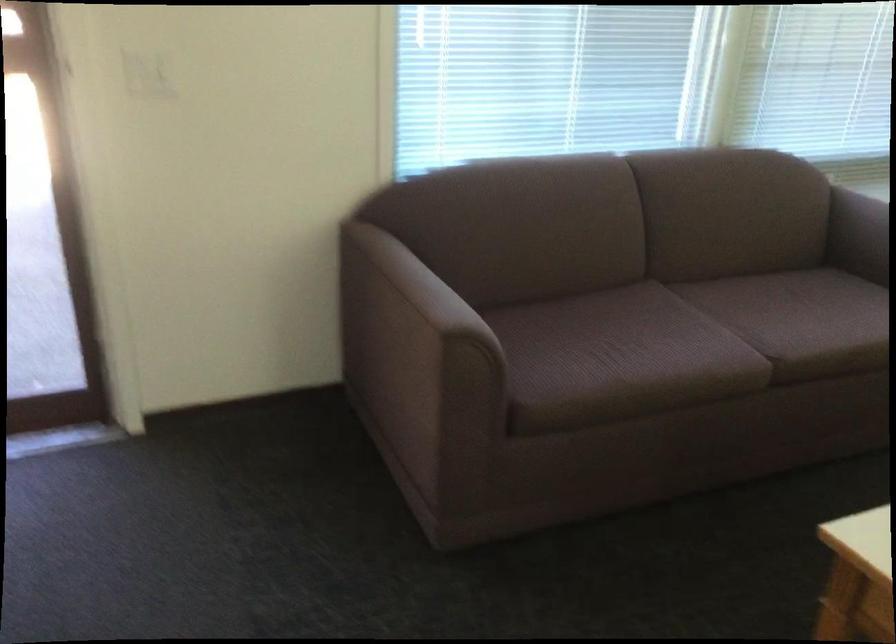
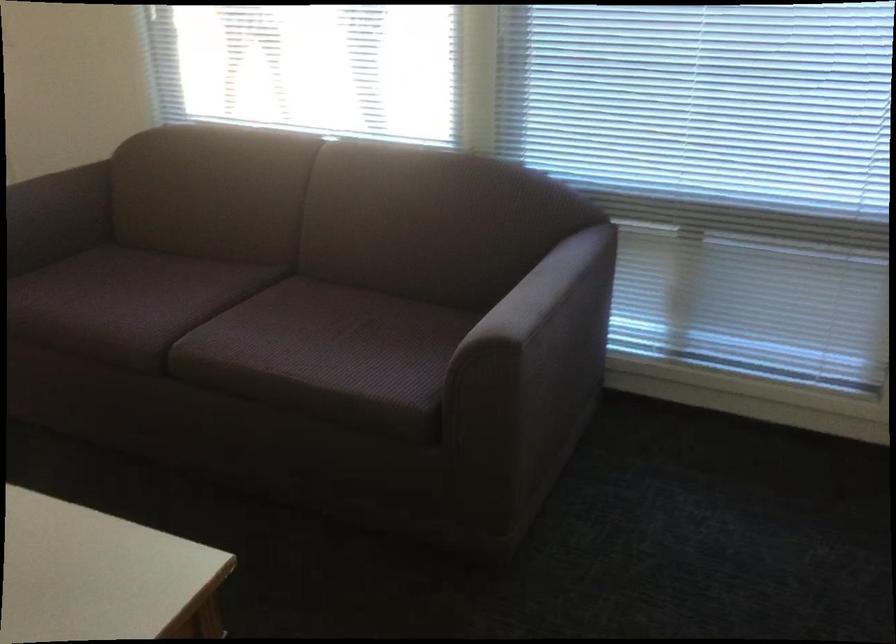
Find the pixel in the second image that matches point (433, 292) in the first image.

(56, 216)